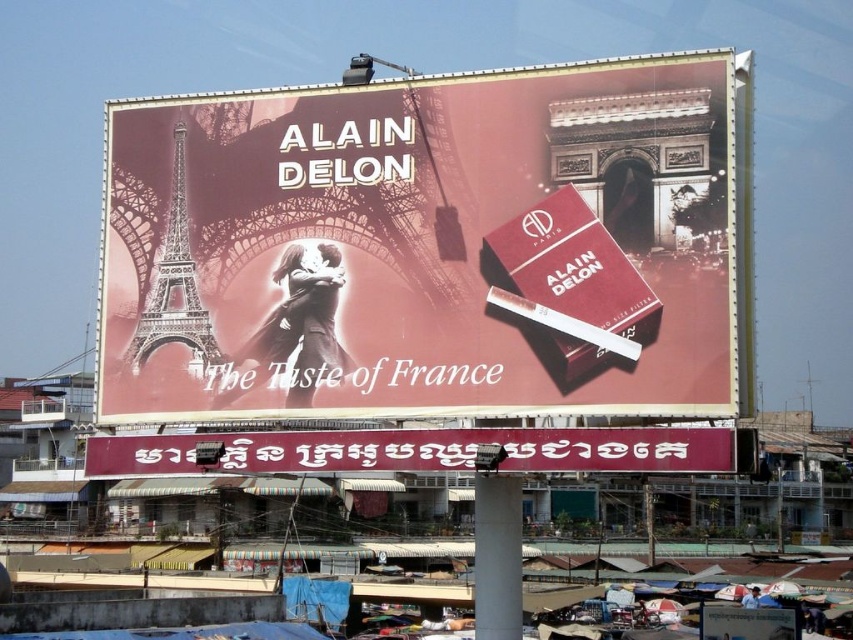
Does matte red cigarette pack at center have a lesser height compared to maroon fabric banner at lower center?

Incorrect, matte red cigarette pack at center's height does not fall short of maroon fabric banner at lower center's.

The width and height of the screenshot is (853, 640). What are the coordinates of `matte red cigarette pack at center` in the screenshot? It's located at (433, 246).

Which is above, maroon fabric banner at lower center or metallic silver eiffel tower at left?

metallic silver eiffel tower at left

Is maroon fabric banner at lower center thinner than metallic silver eiffel tower at left?

In fact, maroon fabric banner at lower center might be wider than metallic silver eiffel tower at left.

Locate an element on the screen. The height and width of the screenshot is (640, 853). maroon fabric banner at lower center is located at coordinates (419, 451).

Which is more to the left, matte red cigarette pack at center or metallic silver eiffel tower at left?

Positioned to the left is metallic silver eiffel tower at left.

Does matte red cigarette pack at center have a greater width compared to metallic silver eiffel tower at left?

Indeed, matte red cigarette pack at center has a greater width compared to metallic silver eiffel tower at left.

Locate an element on the screen. Image resolution: width=853 pixels, height=640 pixels. matte red cigarette pack at center is located at coordinates (433, 246).

At what (x,y) coordinates should I click in order to perform the action: click on matte red cigarette pack at center. Please return your answer as a coordinate pair (x, y). Looking at the image, I should click on (433, 246).